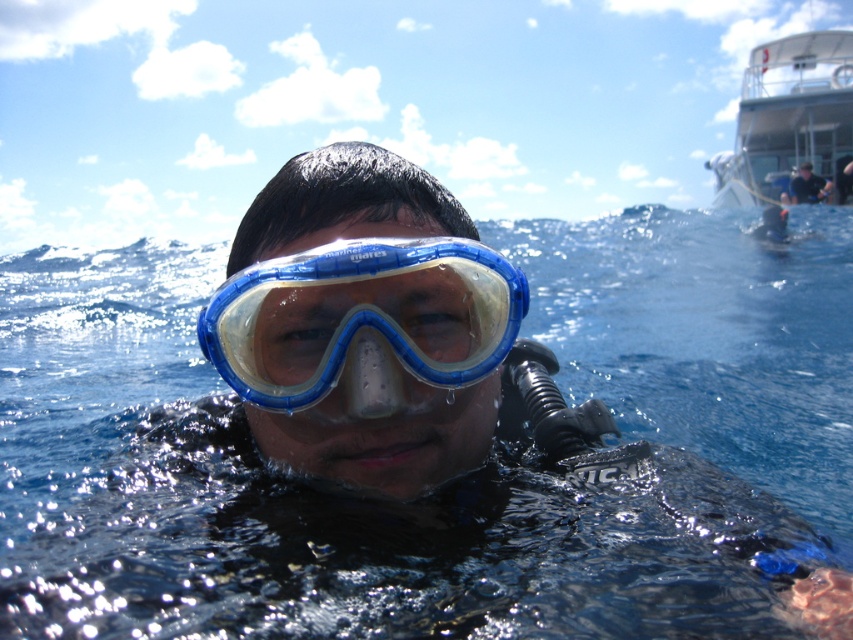
Is point (427, 356) behind point (780, 166)?

No, (427, 356) is in front of (780, 166).

Is point (434, 312) closer to viewer compared to point (804, 124)?

That is True.

Does point (454, 321) come in front of point (825, 29)?

That is True.

The image size is (853, 640). Identify the location of transparent plastic goggles at center. (363, 320).

Which is behind, point (379, 276) or point (822, 188)?

The point (822, 188) is behind.

In the scene shown: Can you confirm if transparent plastic goggles at center is positioned below dark blue fabric shirt at upper right?

Correct, transparent plastic goggles at center is located below dark blue fabric shirt at upper right.

Who is more forward, (422,256) or (804,182)?

Positioned in front is point (422,256).

Locate an element on the screen. The image size is (853, 640). transparent plastic goggles at center is located at coordinates (363, 320).

Is transparent blue water at center smaller than dark blue fabric shirt at upper right?

No, transparent blue water at center is not smaller than dark blue fabric shirt at upper right.

Is transparent blue water at center further to the viewer compared to dark blue fabric shirt at upper right?

No.

What do you see at coordinates (447, 484) in the screenshot? I see `transparent blue water at center` at bounding box center [447, 484].

Where is `transparent blue water at center`? The width and height of the screenshot is (853, 640). transparent blue water at center is located at coordinates (447, 484).